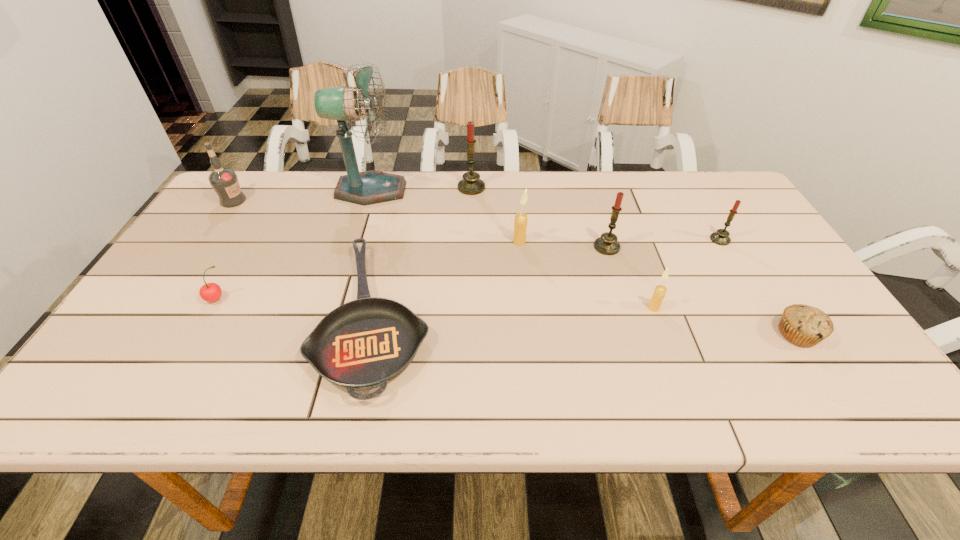
Image resolution: width=960 pixels, height=540 pixels. What are the coordinates of `vacant space that's between the seventh object from left to right and the left cream candle` in the screenshot? It's located at (x=563, y=244).

Locate which object ranks sixth in proximity to the blue fan. Please provide its 2D coordinates. Your answer should be formatted as a tuple, i.e. [(x, y)], where the tuple contains the x and y coordinates of a point satisfying the conditions above.

[(607, 244)]

Where is `object that is the fifth closest to the black frying pan`? object that is the fifth closest to the black frying pan is located at coordinates (224, 181).

Locate which candle is the third closest to the shortest object. Please provide its 2D coordinates. Your answer should be formatted as a tuple, i.e. [(x, y)], where the tuple contains the x and y coordinates of a point satisfying the conditions above.

[(607, 244)]

Select which candle is the fourth closest to the muffin. Please provide its 2D coordinates. Your answer should be formatted as a tuple, i.e. [(x, y)], where the tuple contains the x and y coordinates of a point satisfying the conditions above.

[(520, 224)]

At what (x,y) coordinates should I click in order to perform the action: click on red candle that is the closest one to the rightmost red candle. Please return your answer as a coordinate pair (x, y). The height and width of the screenshot is (540, 960). Looking at the image, I should click on (607, 244).

Choose which red candle is the nearest neighbor to the second red candle from right to left. Please provide its 2D coordinates. Your answer should be formatted as a tuple, i.e. [(x, y)], where the tuple contains the x and y coordinates of a point satisfying the conditions above.

[(721, 237)]

This screenshot has width=960, height=540. Identify the location of vacant space that satisfies the following two spatial constraints: 1. on the front side of the frying pan; 2. on the right side of the eighth tallest object. (207, 316).

I want to click on vacant space that satisfies the following two spatial constraints: 1. on the front label of the smaller cream candle; 2. on the right side of the leftmost object, so click(160, 308).

Find the location of a particular element. Image resolution: width=960 pixels, height=540 pixels. vacant area that satisfies the following two spatial constraints: 1. on the front side of the tallest candle; 2. on the right side of the left cream candle is located at coordinates (470, 241).